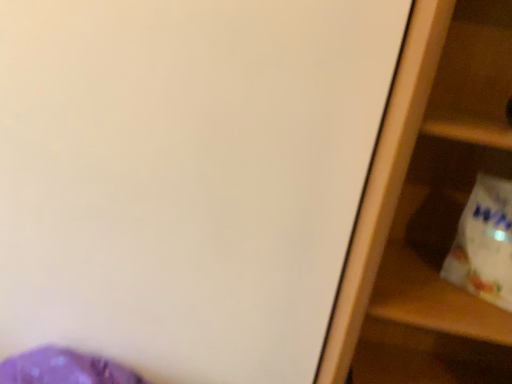
At what (x,y) coordinates should I click in order to perform the action: click on white plastic grocery bag at right. Please return your answer as a coordinate pair (x, y). The width and height of the screenshot is (512, 384). Looking at the image, I should click on (484, 243).

What is the approximate width of white plastic grocery bag at right?

white plastic grocery bag at right is 8.85 centimeters wide.

Describe the element at coordinates (484, 243) in the screenshot. Image resolution: width=512 pixels, height=384 pixels. I see `white plastic grocery bag at right` at that location.

What is the approximate height of wooden shelf at right?

wooden shelf at right is 1.23 meters in height.

The image size is (512, 384). What are the coordinates of `wooden shelf at right` in the screenshot? It's located at (445, 220).

The image size is (512, 384). What do you see at coordinates (445, 220) in the screenshot?
I see `wooden shelf at right` at bounding box center [445, 220].

What is the approximate width of wooden shelf at right?

It is 17.45 inches.

At what (x,y) coordinates should I click in order to perform the action: click on white plastic grocery bag at right. Please return your answer as a coordinate pair (x, y). Looking at the image, I should click on (484, 243).

Between wooden shelf at right and white plastic grocery bag at right, which one appears on the right side from the viewer's perspective?

Positioned to the right is white plastic grocery bag at right.

Relative to white plastic grocery bag at right, is wooden shelf at right in front or behind?

wooden shelf at right is in front of white plastic grocery bag at right.

Is point (433, 192) positioned after point (490, 239)?

Yes, it is behind point (490, 239).

From the image's perspective, is wooden shelf at right on top of white plastic grocery bag at right?

No.

From a real-world perspective, which is physically below, wooden shelf at right or white plastic grocery bag at right?

From a 3D spatial view, wooden shelf at right is below.

Which object is wider, wooden shelf at right or white plastic grocery bag at right?

wooden shelf at right.

Can you confirm if wooden shelf at right is shorter than white plastic grocery bag at right?

No, wooden shelf at right is not shorter than white plastic grocery bag at right.

Between wooden shelf at right and white plastic grocery bag at right, which one has larger size?

wooden shelf at right is bigger.

Would you say wooden shelf at right contains white plastic grocery bag at right?

That's correct, white plastic grocery bag at right is inside wooden shelf at right.

Looking at this image, is wooden shelf at right not near white plastic grocery bag at right?

No, there isn't a large distance between wooden shelf at right and white plastic grocery bag at right.

Is wooden shelf at right oriented towards white plastic grocery bag at right?

Yes, wooden shelf at right faces towards white plastic grocery bag at right.

How different are the orientations of wooden shelf at right and white plastic grocery bag at right in degrees?

The angle between the facing direction of wooden shelf at right and the facing direction of white plastic grocery bag at right is 32.1 degrees.

Identify the location of grocery bag above the wooden shelf at right (from the image's perspective). (484, 243).

Between white plastic grocery bag at right and wooden shelf at right, which one appears on the left side from the viewer's perspective?

wooden shelf at right is more to the left.

From the picture: Between white plastic grocery bag at right and wooden shelf at right, which one is positioned in front?

wooden shelf at right is in front.

Is point (481, 264) closer or farther from the camera than point (371, 302)?

Point (481, 264) is farther from the camera than point (371, 302).

From the image's perspective, is white plastic grocery bag at right beneath wooden shelf at right?

Actually, white plastic grocery bag at right appears above wooden shelf at right in the image.

From a real-world perspective, between white plastic grocery bag at right and wooden shelf at right, who is vertically higher?

From a 3D spatial view, white plastic grocery bag at right is above.

Looking at this image, which of these two, white plastic grocery bag at right or wooden shelf at right, is thinner?

white plastic grocery bag at right is thinner.

Who is shorter, white plastic grocery bag at right or wooden shelf at right?

With less height is white plastic grocery bag at right.

Between white plastic grocery bag at right and wooden shelf at right, which one has larger size?

wooden shelf at right.

Would you say white plastic grocery bag at right is inside or outside wooden shelf at right?

white plastic grocery bag at right is spatially positioned inside wooden shelf at right.

Are white plastic grocery bag at right and wooden shelf at right making contact?

No, white plastic grocery bag at right is not in contact with wooden shelf at right.

Is white plastic grocery bag at right turned away from wooden shelf at right?

Yes, wooden shelf at right is at the back of white plastic grocery bag at right.

Can you tell me how much white plastic grocery bag at right and wooden shelf at right differ in facing direction?

There is a 32.1-degree angle between the facing directions of white plastic grocery bag at right and wooden shelf at right.

At what (x,y) coordinates should I click in order to perform the action: click on shelf in front of the white plastic grocery bag at right. Please return your answer as a coordinate pair (x, y). The height and width of the screenshot is (384, 512). Looking at the image, I should click on (445, 220).

This screenshot has width=512, height=384. I want to click on shelf below the white plastic grocery bag at right (from a real-world perspective), so click(x=445, y=220).

Locate an element on the screen. This screenshot has height=384, width=512. grocery bag above the wooden shelf at right (from the image's perspective) is located at coordinates (484, 243).